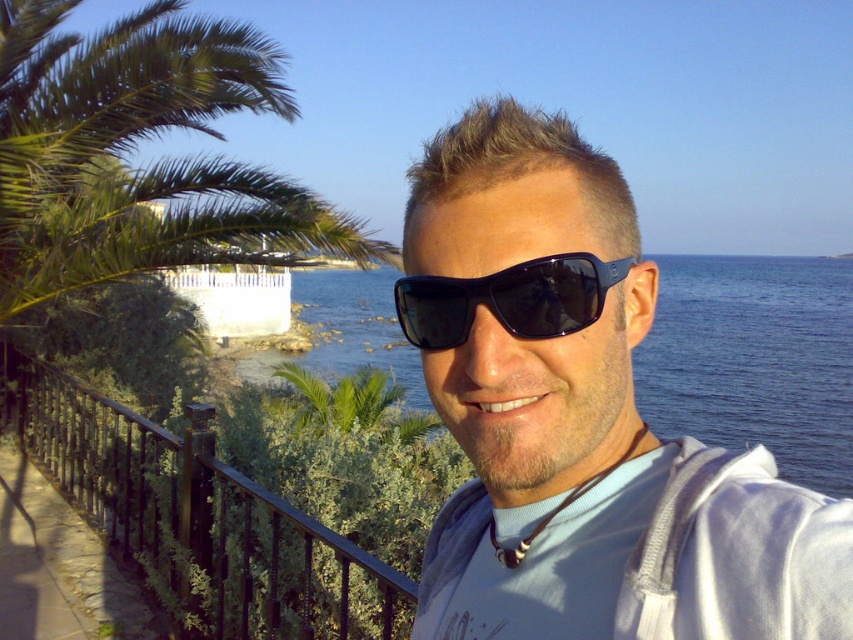
You are a photographer trying to capture the perfect shot of the two points in the scene. Which point, point (x=96, y=513) or point (x=842, y=282), would appear larger in your photo?

Point (x=96, y=513) appears larger in the photo because it is closer to the camera than point (x=842, y=282).

You are standing at the center of the image and want to take a photo of the black wrought iron railing at lower left. In which direction should you move to get a better view of it?

The black wrought iron railing at lower left is located at point (196, 518), so you should move to your left to get a better view of it.